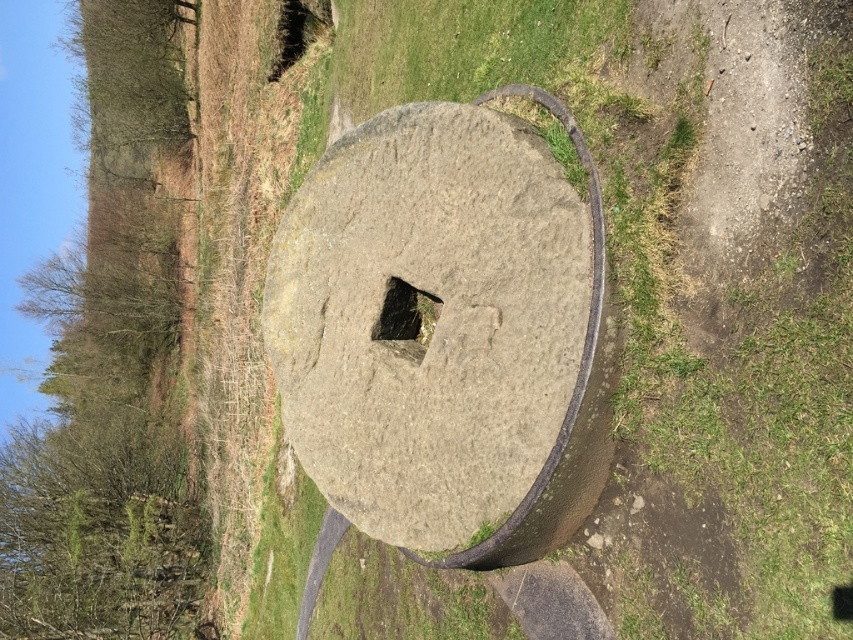
You are standing in the middle of the grassy area with patches of dirt and want to place a small flag exactly at the center of the gray stone at center. According to the coordinates provided, where should you place the flag?

The gray stone at center should have the flag placed at its 2D location coordinates of point (436, 321).

You are a gardener planning to place a 24 inch wide decorative stone between the gray stone at center and the green mossy stone at center. Based on the scene, will there be enough space for the stone?

The distance between the gray stone at center and the green mossy stone at center is 22.90 inches. Since the decorative stone is 24 inches wide, it will not fit between them as the space is slightly narrower than the stone.

You are a geologist examining two stones in the center of a circular stone millstone. The gray stone at center and the green mossy stone at center are both present. Which stone is taller?

The gray stone at center is taller than the green mossy stone at center.